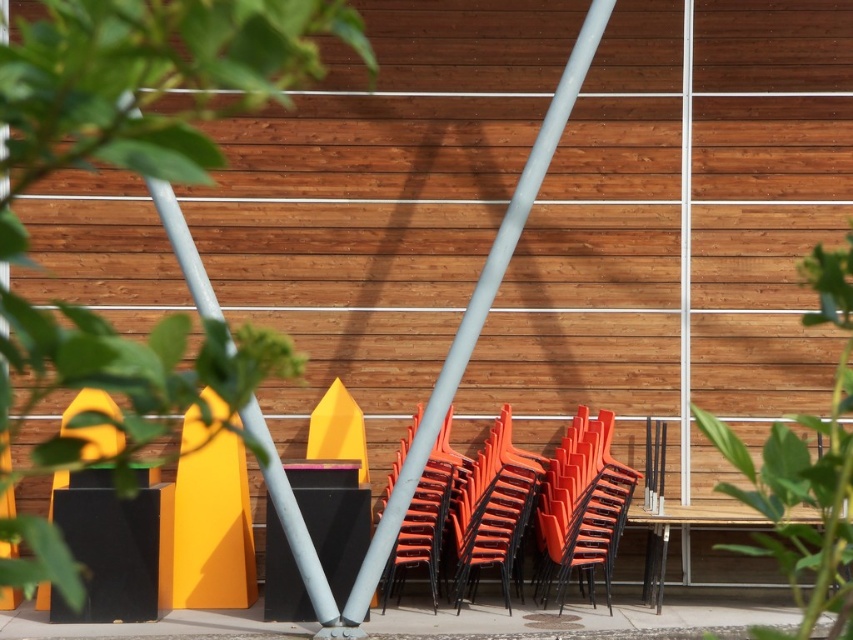
You are setting up a small table that is 4.5 feet wide between the orange plastic chairs at center and the smooth gray pole at center. Will the table fit between them?

The distance between the orange plastic chairs at center and the smooth gray pole at center is 5.01 feet, so the table that is 4.5 feet wide will fit between them since it is narrower than the available space.